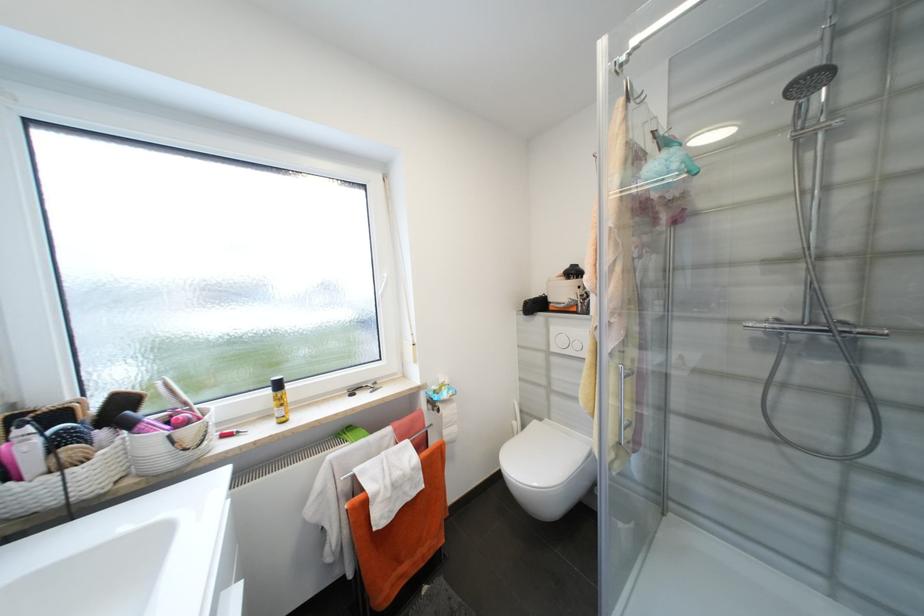
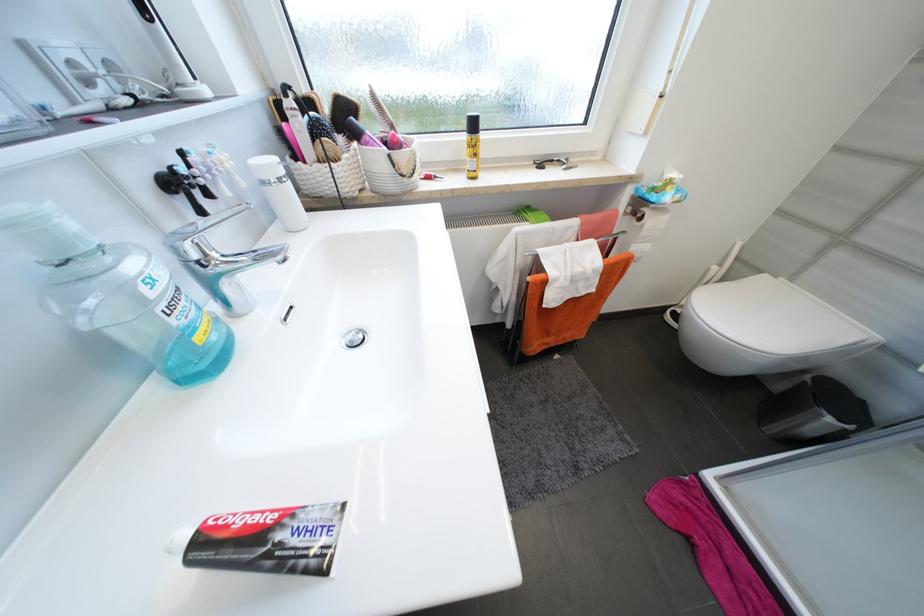
Where in the second image is the point corresponding to pixel 626 525 from the first image?

(834, 421)